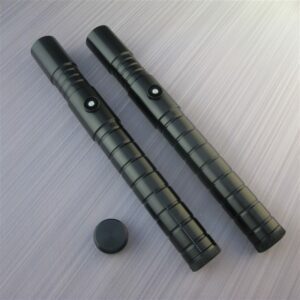
Identify the location of wooden surface. (177, 167).